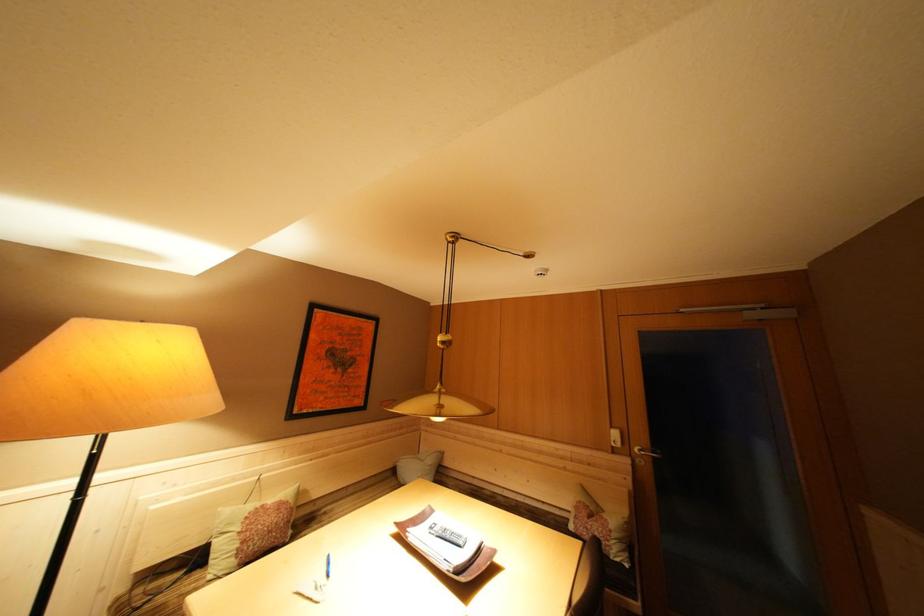
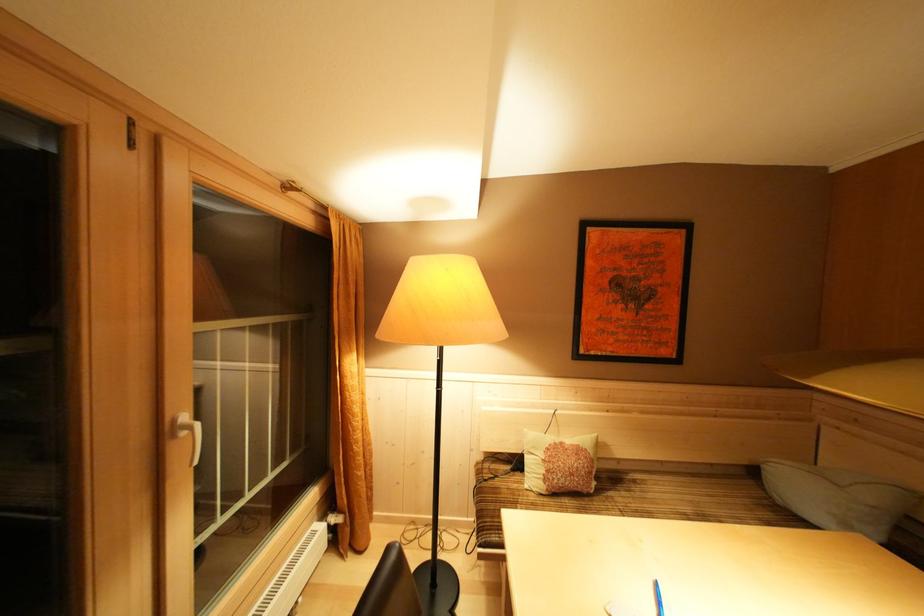
Where in the second image is the point corresponding to pixel 271 511 from the first image?

(568, 448)